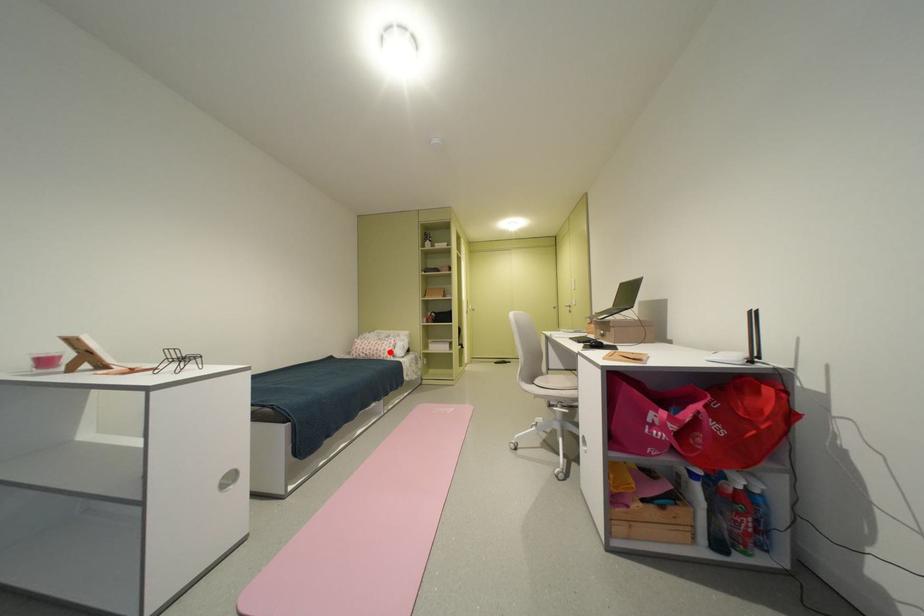
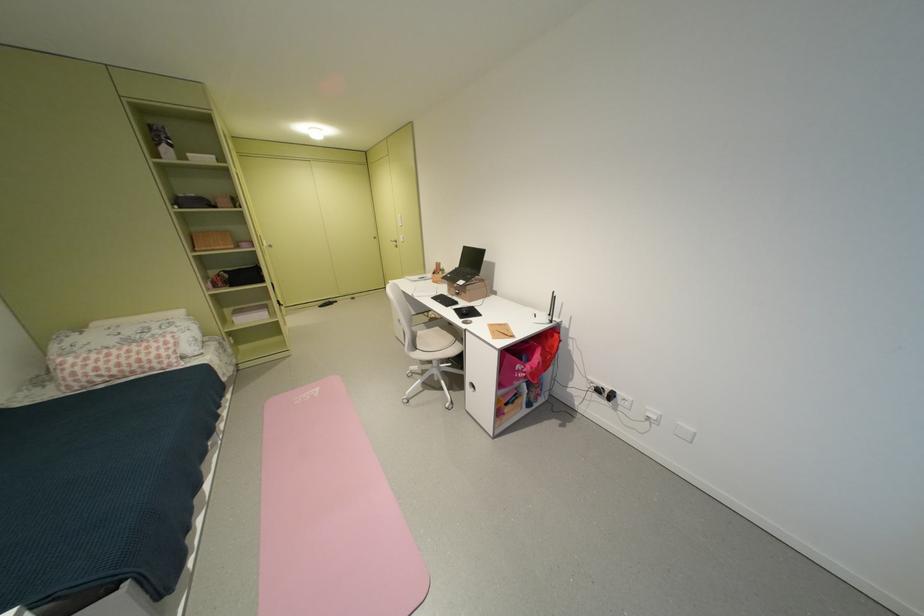
Question: I am providing you with two images of the same scene from different viewpoints. A red point is shown in image1. For the corresponding object point in image2, is it positioned nearer or farther from the camera?

Choices:
 (A) Nearer
 (B) Farther

Answer: (A)